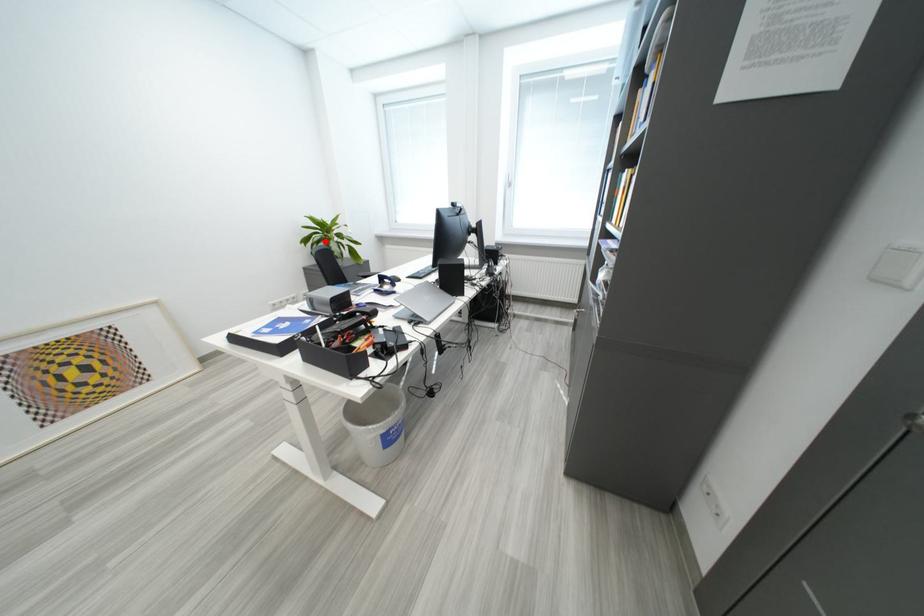
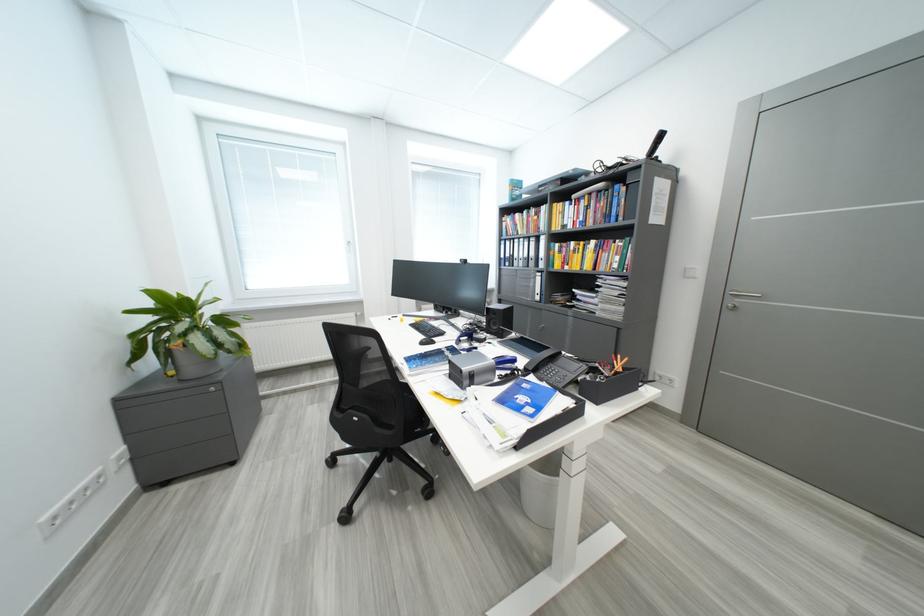
Question: I am providing you with two images of the same scene from different viewpoints. Image1 has a red point marked. In image2, the corresponding 3D location appears at what relative position? Reply with the corresponding letter.

Choices:
 (A) Closer
 (B) Farther

Answer: (B)